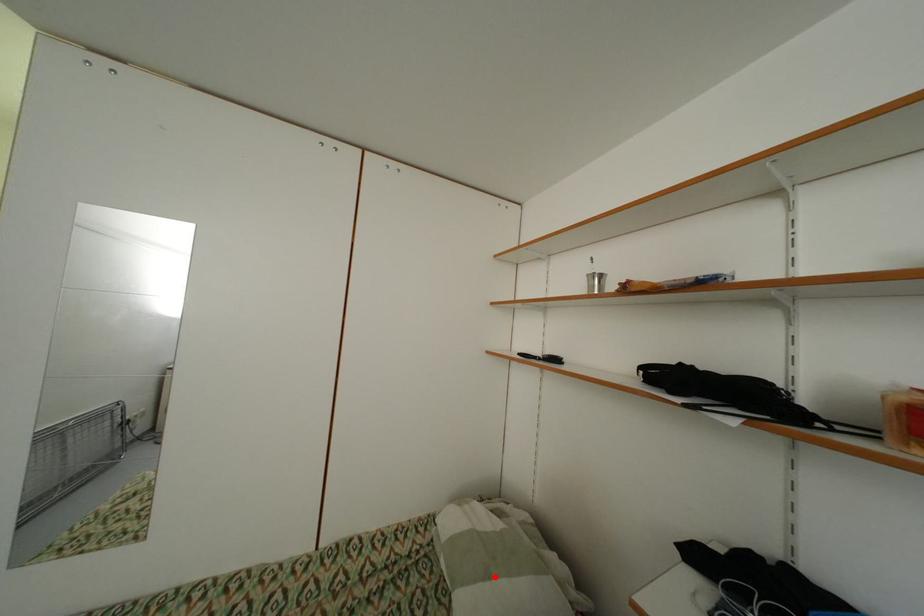
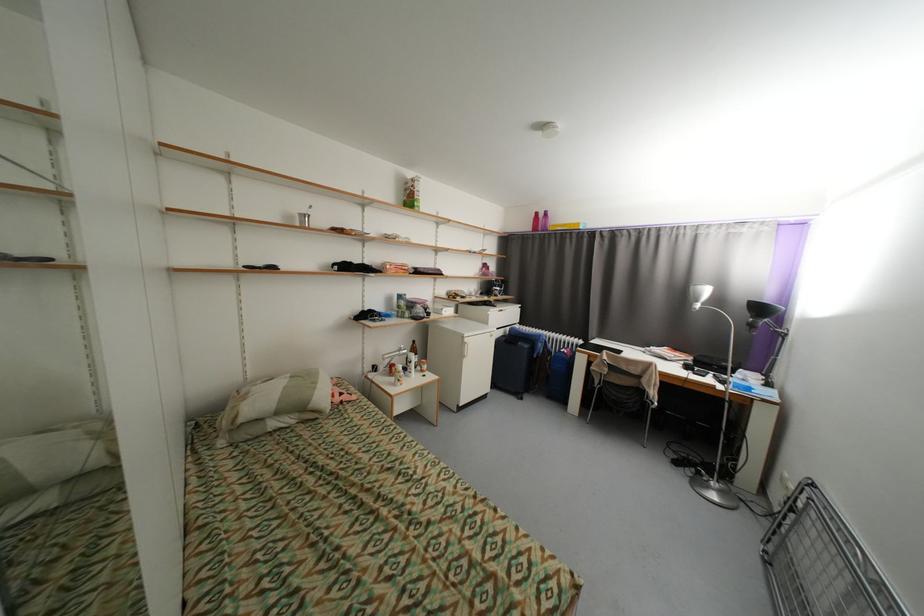
Where in the second image is the point corresponding to the highlighted location from the first image?

(322, 384)